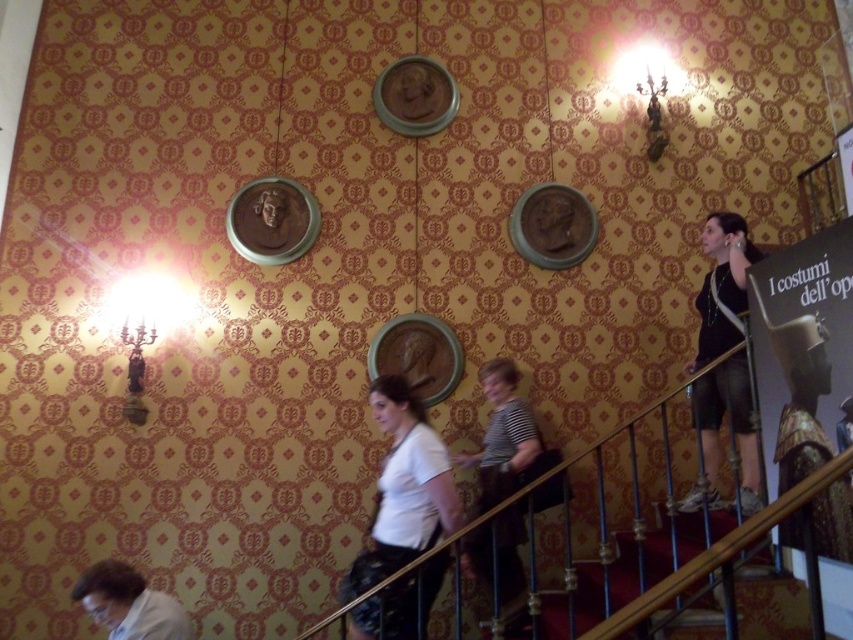
Who is positioned more to the left, wooden handrail at lower right or white shirt at lower left?

white shirt at lower left

Describe the element at coordinates (624, 570) in the screenshot. This screenshot has height=640, width=853. I see `wooden handrail at lower right` at that location.

Does point (674, 605) come in front of point (122, 570)?

Yes, it is.

At what (x,y) coordinates should I click in order to perform the action: click on wooden handrail at lower right. Please return your answer as a coordinate pair (x, y). Image resolution: width=853 pixels, height=640 pixels. Looking at the image, I should click on (624, 570).

Can you confirm if white matte shirt at center is taller than dark gray fabric shorts at right?

No, white matte shirt at center is not taller than dark gray fabric shorts at right.

Locate an element on the screen. white matte shirt at center is located at coordinates (403, 490).

Is white matte shirt at center shorter than white shirt at lower left?

No.

Does white matte shirt at center appear over white shirt at lower left?

Yes, white matte shirt at center is above white shirt at lower left.

Where is `white matte shirt at center`? white matte shirt at center is located at coordinates (403, 490).